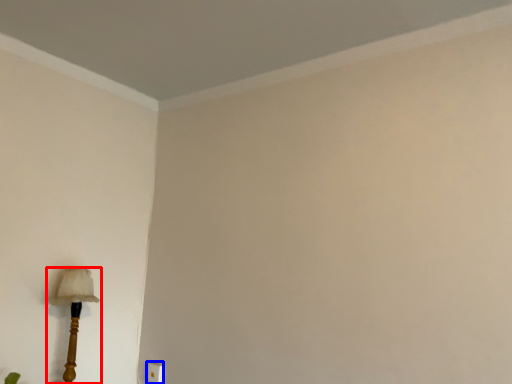
Question: Which of the following is the closest to the observer, lamp (highlighted by a red box) or electric outlet (highlighted by a blue box)?

Choices:
 (A) lamp
 (B) electric outlet

Answer: (A)